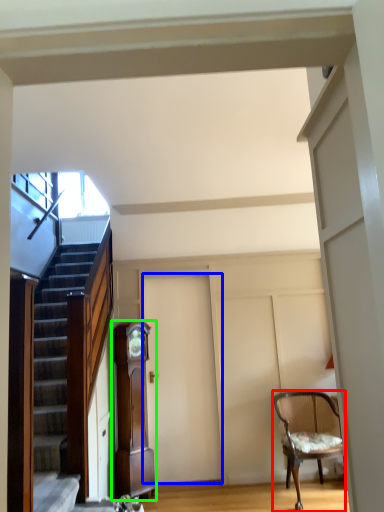
Question: Estimate the real-world distances between objects in this image. Which object is closer to chair (highlighted by a red box), door (highlighted by a blue box) or cabinetry (highlighted by a green box)?

Choices:
 (A) door
 (B) cabinetry

Answer: (A)